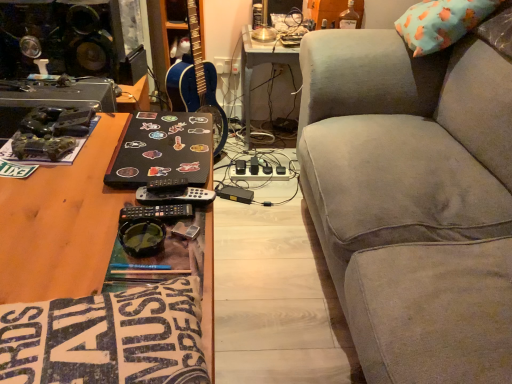
Question: Is gray fabric couch at right placed right next to black plastic remote at center?

Choices:
 (A) yes
 (B) no

Answer: (B)

Question: Is gray fabric couch at right further to camera compared to black plastic remote at center?

Choices:
 (A) yes
 (B) no

Answer: (B)

Question: From a real-world perspective, is gray fabric couch at right beneath black plastic remote at center?

Choices:
 (A) yes
 (B) no

Answer: (A)

Question: Is gray fabric couch at right wider than black plastic remote at center?

Choices:
 (A) yes
 (B) no

Answer: (A)

Question: Can you confirm if gray fabric couch at right is shorter than black plastic remote at center?

Choices:
 (A) no
 (B) yes

Answer: (A)

Question: Relative to gray fabric couch at right, is black plastic remote at center in front or behind?

Choices:
 (A) behind
 (B) front

Answer: (A)

Question: From a real-world perspective, is black plastic remote at center physically located above or below gray fabric couch at right?

Choices:
 (A) above
 (B) below

Answer: (A)

Question: Would you say black plastic remote at center is to the left or to the right of gray fabric couch at right in the picture?

Choices:
 (A) left
 (B) right

Answer: (A)

Question: Looking at the image, does black plastic remote at center seem bigger or smaller compared to gray fabric couch at right?

Choices:
 (A) small
 (B) big

Answer: (A)

Question: In terms of width, does blue glossy guitar at center look wider or thinner when compared to white plastic table at center?

Choices:
 (A) thin
 (B) wide

Answer: (A)

Question: Which is correct: blue glossy guitar at center is inside white plastic table at center, or outside of it?

Choices:
 (A) inside
 (B) outside

Answer: (B)

Question: From a real-world perspective, is blue glossy guitar at center above or below white plastic table at center?

Choices:
 (A) below
 (B) above

Answer: (B)

Question: From the image's perspective, is blue glossy guitar at center above or below white plastic table at center?

Choices:
 (A) below
 (B) above

Answer: (A)

Question: Is sticker-covered black laptop at center bigger or smaller than black plastic remote at center?

Choices:
 (A) small
 (B) big

Answer: (B)

Question: From their relative heights in the image, would you say sticker-covered black laptop at center is taller or shorter than black plastic remote at center?

Choices:
 (A) tall
 (B) short

Answer: (A)